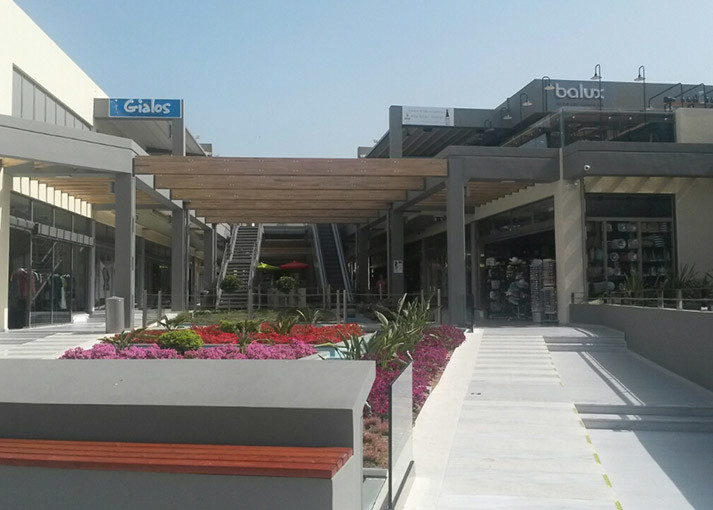
The image size is (713, 510). In order to click on grey pillars in this screenshot , I will do `click(455, 239)`, `click(398, 241)`, `click(361, 247)`, `click(396, 129)`, `click(122, 239)`, `click(180, 251)`, `click(209, 250)`.